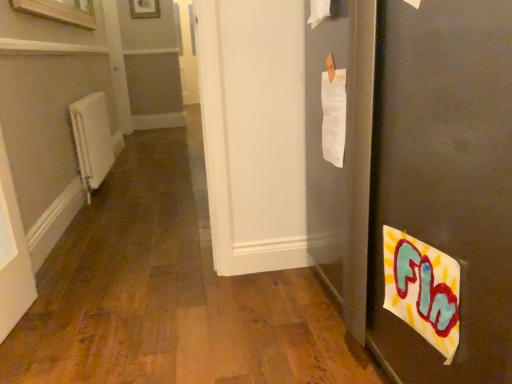
Describe the element at coordinates (445, 177) in the screenshot. The width and height of the screenshot is (512, 384). I see `matte black door at right` at that location.

The image size is (512, 384). In order to click on wooden frame at upper center in this screenshot , I will do `click(144, 9)`.

Is matte black door at right positioned far away from white matte radiator at left?

Yes, matte black door at right is far from white matte radiator at left.

How far apart are matte black door at right and white matte radiator at left?

matte black door at right is 2.65 meters away from white matte radiator at left.

From the image's perspective, between matte black door at right and white matte radiator at left, which one is located above?

white matte radiator at left appears higher in the image.

Between matte black door at right and white matte radiator at left, which one has smaller width?

white matte radiator at left.

From a real-world perspective, is wooden frame at upper center beneath white matte radiator at left?

Actually, wooden frame at upper center is physically above white matte radiator at left in the real world.

Is wooden frame at upper center taller than white matte radiator at left?

No.

Which object is further away from the camera taking this photo, wooden frame at upper center or white matte radiator at left?

wooden frame at upper center is further away from the camera.

Is white matte radiator at left completely or partially inside wooden frame at upper center?

No, wooden frame at upper center does not contain white matte radiator at left.

Looking at this image, how many degrees apart are the facing directions of white matte radiator at left and wooden frame at upper center?

88.5 degrees.

Is white matte radiator at left inside or outside of wooden frame at upper center?

white matte radiator at left is located beyond the bounds of wooden frame at upper center.

From a real-world perspective, is white matte radiator at left beneath wooden frame at upper center?

Correct, in the physical world, white matte radiator at left is lower than wooden frame at upper center.

Does white matte radiator at left have a lesser width compared to wooden frame at upper center?

No, white matte radiator at left is not thinner than wooden frame at upper center.

In terms of width, does matte black door at right look wider or thinner when compared to wooden frame at upper center?

matte black door at right is wider than wooden frame at upper center.

Are matte black door at right and wooden frame at upper center making contact?

They are not placed beside each other.

Does matte black door at right appear on the right side of wooden frame at upper center?

Yes.

Based on their sizes in the image, would you say matte black door at right is bigger or smaller than wooden frame at upper center?

matte black door at right is bigger than wooden frame at upper center.

From a real-world perspective, is white matte radiator at left physically below matte black door at right?

Yes, from a real-world perspective, white matte radiator at left is below matte black door at right.

How different are the orientations of white matte radiator at left and matte black door at right in degrees?

178 degrees separate the facing orientations of white matte radiator at left and matte black door at right.

Considering the sizes of objects white matte radiator at left and matte black door at right in the image provided, who is thinner, white matte radiator at left or matte black door at right?

With smaller width is white matte radiator at left.

Who is more distant, white matte radiator at left or matte black door at right?

white matte radiator at left is further away from the camera.

How different are the orientations of wooden frame at upper center and matte black door at right in degrees?

The facing directions of wooden frame at upper center and matte black door at right are 89 degrees apart.

From the image's perspective, which is below, wooden frame at upper center or matte black door at right?

matte black door at right appears lower in the image.

From a real-world perspective, which object stands above the other?

From a 3D spatial view, wooden frame at upper center is above.

In the scene shown: Between wooden frame at upper center and matte black door at right, which one has less height?

With less height is wooden frame at upper center.

The height and width of the screenshot is (384, 512). What are the coordinates of `radiator that is behind the matte black door at right` in the screenshot? It's located at (92, 140).

The width and height of the screenshot is (512, 384). In the image, there is a wooden frame at upper center. Find the location of `radiator below it (from the image's perspective)`. radiator below it (from the image's perspective) is located at coordinates 92,140.

Looking at the image, which one is located further to matte black door at right, wooden frame at upper center or white matte radiator at left?

Based on the image, wooden frame at upper center appears to be further to matte black door at right.

When comparing their distances from matte black door at right, does white matte radiator at left or wooden frame at upper center seem closer?

white matte radiator at left is positioned closer to the anchor matte black door at right.

When comparing their distances from wooden frame at upper center, does white matte radiator at left or matte black door at right seem further?

Based on the image, matte black door at right appears to be further to wooden frame at upper center.

From the image, which object appears to be nearer to white matte radiator at left, matte black door at right or wooden frame at upper center?

matte black door at right.

Which object lies nearer to the anchor point wooden frame at upper center, matte black door at right or white matte radiator at left?

white matte radiator at left.

Looking at the image, which one is located closer to white matte radiator at left, wooden frame at upper center or matte black door at right?

matte black door at right is positioned closer to the anchor white matte radiator at left.

Where is `radiator between matte black door at right and wooden frame at upper center in the front-back direction`? The height and width of the screenshot is (384, 512). radiator between matte black door at right and wooden frame at upper center in the front-back direction is located at coordinates (92, 140).